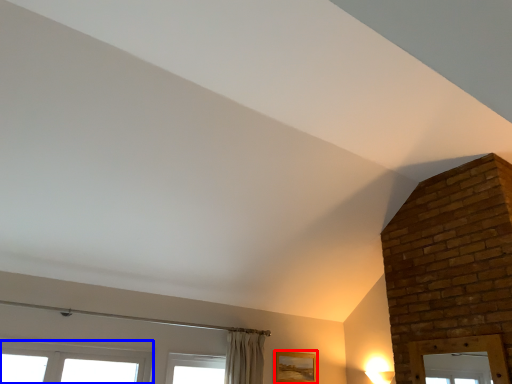
Question: Which point is further to the camera, picture frame (highlighted by a red box) or window (highlighted by a blue box)?

Choices:
 (A) picture frame
 (B) window

Answer: (A)